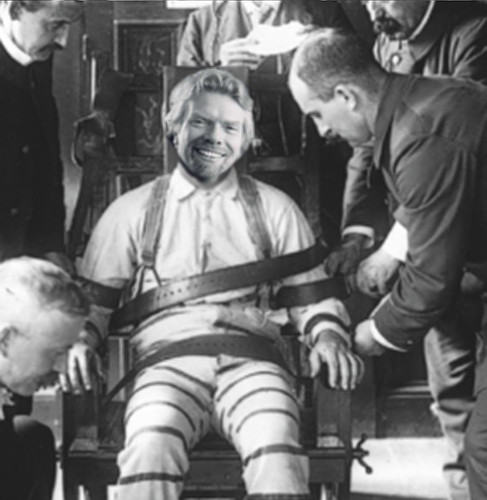
Where is `chair`? The image size is (487, 500). chair is located at coordinates (283, 167).